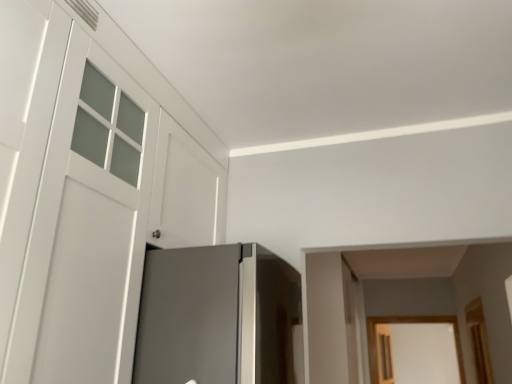
Question: From the image's perspective, is white matte door at left above or below clear glass screen door at lower right?

Choices:
 (A) above
 (B) below

Answer: (A)

Question: In terms of height, does white matte door at left look taller or shorter compared to clear glass screen door at lower right?

Choices:
 (A) tall
 (B) short

Answer: (A)

Question: Considering their positions, is white matte door at left located in front of or behind clear glass screen door at lower right?

Choices:
 (A) behind
 (B) front

Answer: (B)

Question: Considering the positions of clear glass screen door at lower right and white matte door at left in the image, is clear glass screen door at lower right taller or shorter than white matte door at left?

Choices:
 (A) short
 (B) tall

Answer: (A)

Question: From the image's perspective, is clear glass screen door at lower right above or below white matte door at left?

Choices:
 (A) below
 (B) above

Answer: (A)

Question: Is clear glass screen door at lower right to the left or to the right of white matte door at left in the image?

Choices:
 (A) right
 (B) left

Answer: (A)

Question: Relative to white matte door at left, is clear glass screen door at lower right in front or behind?

Choices:
 (A) behind
 (B) front

Answer: (A)